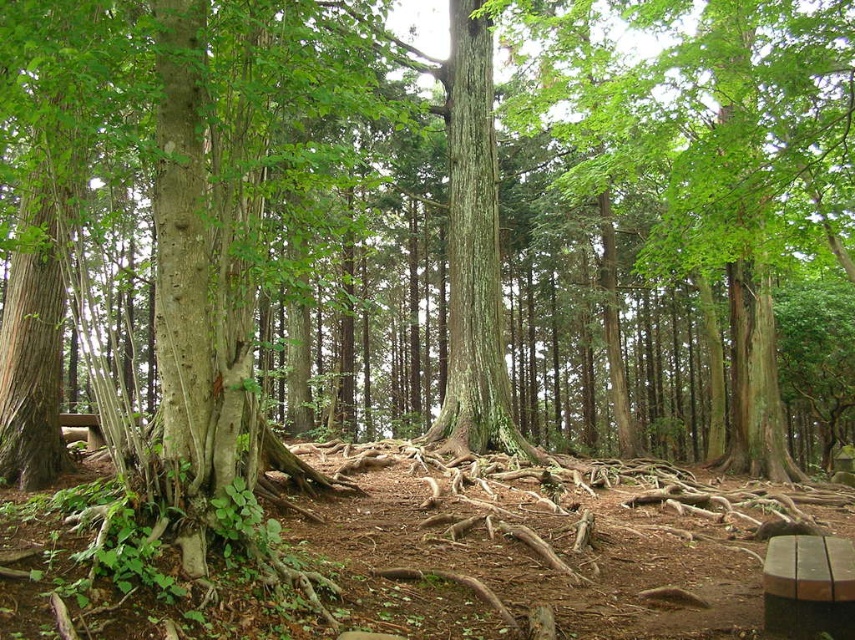
You are standing in the forest and see a point marked at coordinates (708, 156). Based on the scene description, what object is located at this point?

The point at coordinates (708, 156) corresponds to the green rough bark tree at upper center.

In the scene shown: You are a hiker who wants to take a photo of the green rough bark tree at upper center and the green rough bark tree trunk at center. Which tree should you stand closer to in order to capture both in a single frame?

You should stand closer to the green rough bark tree trunk at center because it is smaller than the green rough bark tree at upper center, allowing both to fit within the camera frame when positioned appropriately.